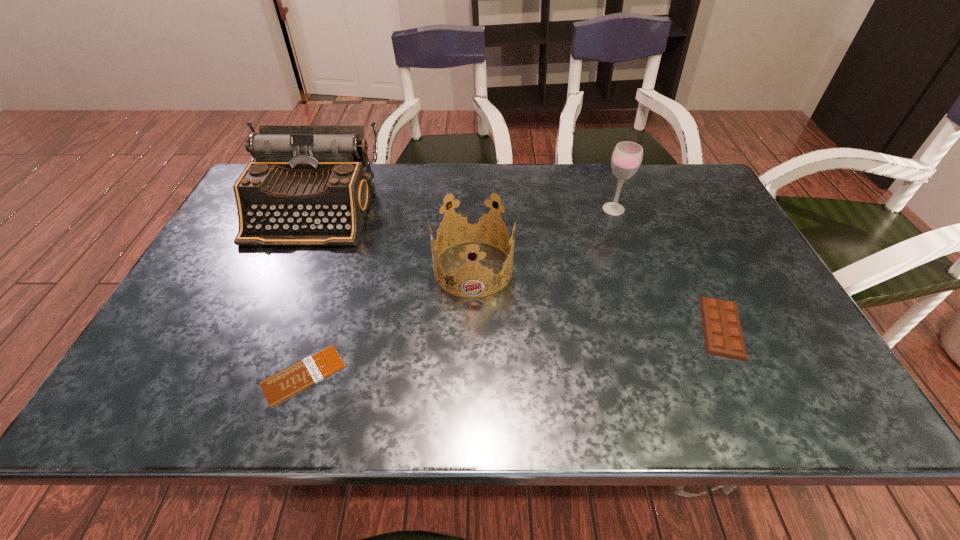
This screenshot has width=960, height=540. What are the coordinates of `free space located 0.060m on the back of the right chocolate bar` in the screenshot? It's located at (699, 279).

Identify the location of free space located 0.100m on the back of the shortest object. This screenshot has width=960, height=540. (324, 310).

This screenshot has height=540, width=960. Find the location of `wineglass that is at the far edge`. wineglass that is at the far edge is located at coordinates (627, 156).

This screenshot has width=960, height=540. I want to click on typewriter present at the far edge, so click(310, 185).

Where is `object located at the near edge`? This screenshot has height=540, width=960. object located at the near edge is located at coordinates (288, 382).

At what (x,y) coordinates should I click in order to perform the action: click on object that is at the left edge. Please return your answer as a coordinate pair (x, y). This screenshot has width=960, height=540. Looking at the image, I should click on (310, 185).

You are a GUI agent. You are given a task and a screenshot of the screen. Output one action in this format:
    pyautogui.click(x=<x>, y=<y>)
    Task: Click on the object present at the right edge
    
    Given the screenshot: What is the action you would take?
    pyautogui.click(x=723, y=336)

This screenshot has width=960, height=540. In order to click on object that is positioned at the far left corner in this screenshot , I will do `click(310, 185)`.

Where is `blank area at the far edge`? The height and width of the screenshot is (540, 960). blank area at the far edge is located at coordinates (438, 194).

The image size is (960, 540). I want to click on free space at the near edge of the desktop, so click(711, 389).